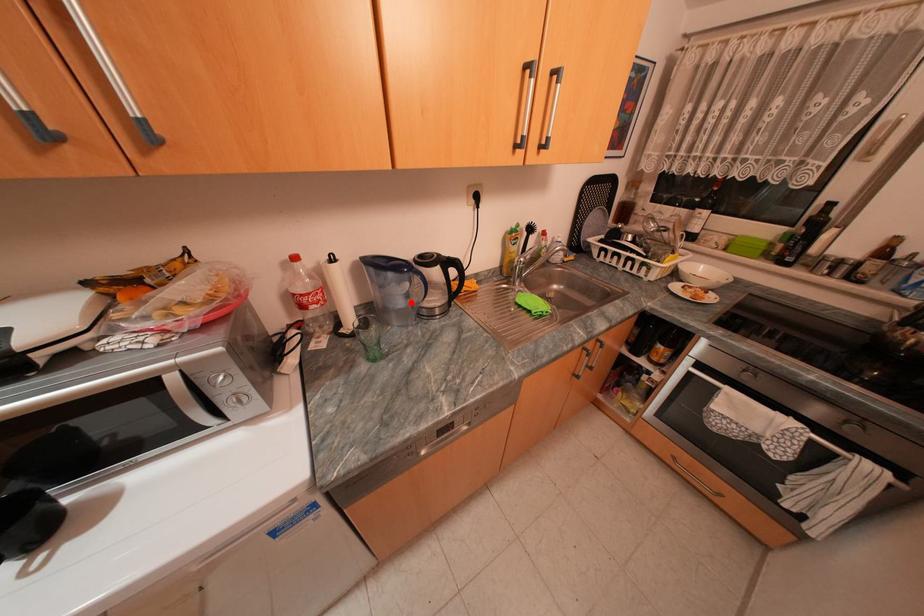
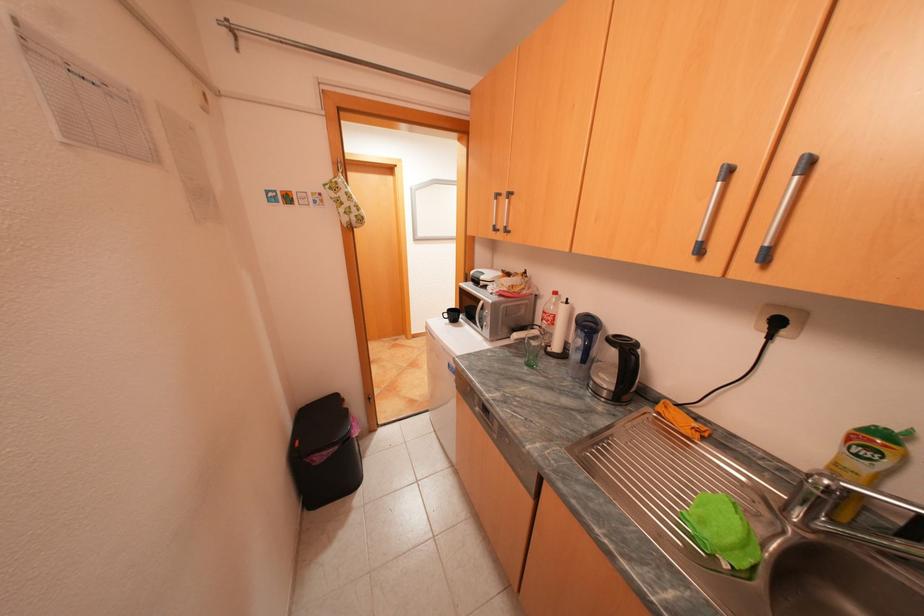
The point at the highlighted location is marked in the first image. Where is the corresponding point in the second image?

(586, 355)